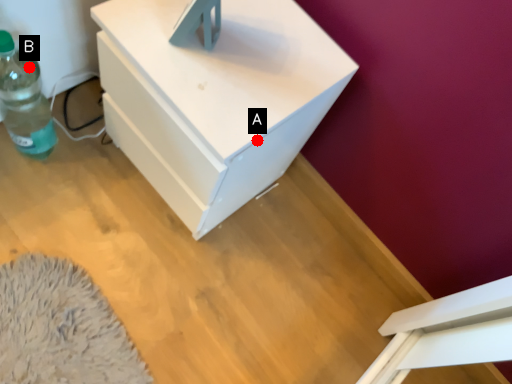
Question: Two points are circled on the image, labeled by A and B beside each circle. Which point appears closest to the camera in this image?

Choices:
 (A) A is closer
 (B) B is closer

Answer: (A)